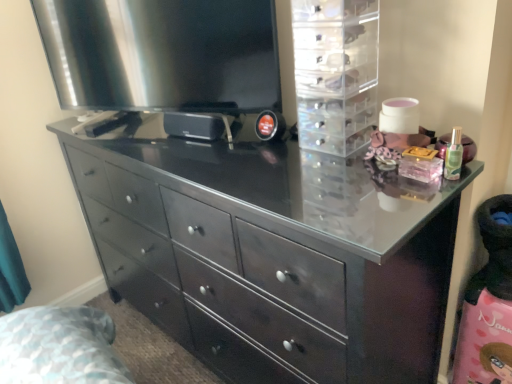
Question: Are black glossy chest of drawers at center and satin black television at upper left making contact?

Choices:
 (A) yes
 (B) no

Answer: (B)

Question: Is black glossy chest of drawers at center far from satin black television at upper left?

Choices:
 (A) no
 (B) yes

Answer: (A)

Question: Considering the relative sizes of black glossy chest of drawers at center and satin black television at upper left in the image provided, is black glossy chest of drawers at center smaller than satin black television at upper left?

Choices:
 (A) yes
 (B) no

Answer: (B)

Question: From the image's perspective, would you say black glossy chest of drawers at center is shown under satin black television at upper left?

Choices:
 (A) no
 (B) yes

Answer: (B)

Question: Does black glossy chest of drawers at center have a greater width compared to satin black television at upper left?

Choices:
 (A) yes
 (B) no

Answer: (A)

Question: From the image's perspective, is black glossy chest of drawers at center on satin black television at upper left?

Choices:
 (A) yes
 (B) no

Answer: (B)

Question: Can you confirm if black glossy chest of drawers at center is smaller than transparent plastic drawers at upper right?

Choices:
 (A) yes
 (B) no

Answer: (B)

Question: Is black glossy chest of drawers at center bigger than transparent plastic drawers at upper right?

Choices:
 (A) yes
 (B) no

Answer: (A)

Question: Is transparent plastic drawers at upper right inside black glossy chest of drawers at center?

Choices:
 (A) no
 (B) yes

Answer: (A)

Question: Is black glossy chest of drawers at center next to transparent plastic drawers at upper right and touching it?

Choices:
 (A) no
 (B) yes

Answer: (A)

Question: Is black glossy chest of drawers at center at the left side of transparent plastic drawers at upper right?

Choices:
 (A) no
 (B) yes

Answer: (B)

Question: Does black glossy chest of drawers at center have a greater width compared to transparent plastic drawers at upper right?

Choices:
 (A) no
 (B) yes

Answer: (B)

Question: Is transparent plastic drawers at upper right far from black glossy chest of drawers at center?

Choices:
 (A) no
 (B) yes

Answer: (A)